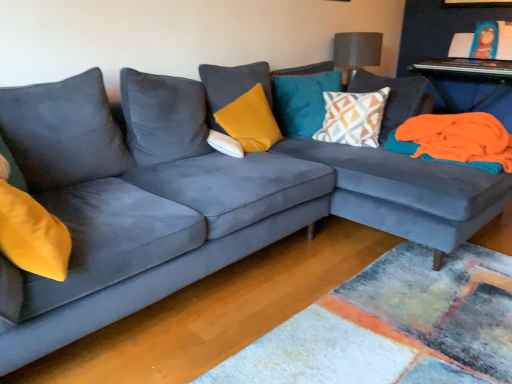
Measure the distance between orange fabric at right, positioned as the 2th table in top-to-bottom order, and camera.

orange fabric at right, positioned as the 2th table in top-to-bottom order, is 11.25 feet away from camera.

I want to click on orange fabric at right, which appears as the first table when ordered from the bottom, so click(471, 85).

Measure the distance between point (456, 72) and camera.

They are 12.63 feet apart.

This screenshot has height=384, width=512. What are the coordinates of `white soft pillow at center, the 1th pillow in the left-to-right sequence` in the screenshot? It's located at (225, 144).

I want to click on yellow velvet pillow at center, positioned as the 2th pillow in left-to-right order, so click(250, 121).

The width and height of the screenshot is (512, 384). What do you see at coordinates (302, 101) in the screenshot?
I see `teal velvet pillow at upper center, the third pillow viewed from the left` at bounding box center [302, 101].

Identify the location of orange fabric at right, which appears as the first table when ordered from the bottom. (471, 85).

Is geometric-patterned fabric pillow at center, the fourth pillow positioned from the left, with white soft pillow at center, the 1th pillow in the left-to-right sequence?

No, geometric-patterned fabric pillow at center, the fourth pillow positioned from the left, is not with white soft pillow at center, the 1th pillow in the left-to-right sequence.

Which is correct: geometric-patterned fabric pillow at center, the fourth pillow positioned from the left, is inside white soft pillow at center, placed as the fourth pillow when sorted from right to left, or outside of it?

geometric-patterned fabric pillow at center, the fourth pillow positioned from the left, cannot be found inside white soft pillow at center, placed as the fourth pillow when sorted from right to left.

What's the angular difference between geometric-patterned fabric pillow at center, placed as the first pillow when sorted from right to left, and white soft pillow at center, the 1th pillow in the left-to-right sequence,'s facing directions?

There is a 118-degree angle between the facing directions of geometric-patterned fabric pillow at center, placed as the first pillow when sorted from right to left, and white soft pillow at center, the 1th pillow in the left-to-right sequence.

Visually, is geometric-patterned fabric pillow at center, the fourth pillow positioned from the left, positioned to the left or to the right of white soft pillow at center, placed as the fourth pillow when sorted from right to left?

Clearly, geometric-patterned fabric pillow at center, the fourth pillow positioned from the left, is on the right of white soft pillow at center, placed as the fourth pillow when sorted from right to left, in the image.

Is metallic silver keyboard at upper right, which ranks as the 2th table in bottom-to-top order, turned away from orange fleece blanket at right?

No, metallic silver keyboard at upper right, which ranks as the 2th table in bottom-to-top order, is not facing away from orange fleece blanket at right.

Who is shorter, metallic silver keyboard at upper right, the 1th table viewed from the top, or orange fleece blanket at right?

orange fleece blanket at right.

Between metallic silver keyboard at upper right, the 1th table viewed from the top, and orange fleece blanket at right, which one has larger width?

With larger width is metallic silver keyboard at upper right, the 1th table viewed from the top.

From the picture: Who is bigger, geometric-patterned fabric pillow at center, the fourth pillow positioned from the left, or textured gray lampshade at upper center?

geometric-patterned fabric pillow at center, the fourth pillow positioned from the left.

Which of these two, geometric-patterned fabric pillow at center, placed as the first pillow when sorted from right to left, or textured gray lampshade at upper center, is thinner?

Thinner between the two is geometric-patterned fabric pillow at center, placed as the first pillow when sorted from right to left.

From a real-world perspective, which is physically above, geometric-patterned fabric pillow at center, the fourth pillow positioned from the left, or textured gray lampshade at upper center?

In real-world perspective, textured gray lampshade at upper center is above.

Between textured gray lampshade at upper center and yellow velvet pillow at center, positioned as the 2th pillow in left-to-right order, which one has smaller width?

yellow velvet pillow at center, positioned as the 2th pillow in left-to-right order, is thinner.

Is textured gray lampshade at upper center bigger or smaller than yellow velvet pillow at center, acting as the 3th pillow starting from the right?

textured gray lampshade at upper center is smaller than yellow velvet pillow at center, acting as the 3th pillow starting from the right.

Considering the relative positions of textured gray lampshade at upper center and yellow velvet pillow at center, positioned as the 2th pillow in left-to-right order, in the image provided, is textured gray lampshade at upper center to the right of yellow velvet pillow at center, positioned as the 2th pillow in left-to-right order, from the viewer's perspective?

Yes.

Is the depth of orange fleece blanket at right greater than that of geometric-patterned fabric pillow at center, placed as the first pillow when sorted from right to left?

No.

Which object is positioned more to the right, orange fleece blanket at right or geometric-patterned fabric pillow at center, the fourth pillow positioned from the left?

orange fleece blanket at right.

From a real-world perspective, who is located higher, orange fleece blanket at right or geometric-patterned fabric pillow at center, placed as the first pillow when sorted from right to left?

geometric-patterned fabric pillow at center, placed as the first pillow when sorted from right to left, from a real-world perspective.

Could geometric-patterned fabric pillow at center, placed as the first pillow when sorted from right to left, be considered to be inside orange fleece blanket at right?

No, geometric-patterned fabric pillow at center, placed as the first pillow when sorted from right to left, is located outside of orange fleece blanket at right.

Considering the sizes of yellow velvet pillow at center, acting as the 3th pillow starting from the right, and textured gray lampshade at upper center in the image, is yellow velvet pillow at center, acting as the 3th pillow starting from the right, bigger or smaller than textured gray lampshade at upper center?

Considering their sizes, yellow velvet pillow at center, acting as the 3th pillow starting from the right, takes up more space than textured gray lampshade at upper center.

Which is closer, (233,119) or (336,51)?

Point (233,119).

Do you think yellow velvet pillow at center, acting as the 3th pillow starting from the right, is within textured gray lampshade at upper center, or outside of it?

yellow velvet pillow at center, acting as the 3th pillow starting from the right, is not inside textured gray lampshade at upper center, it's outside.

Which object is thinner, yellow velvet pillow at center, acting as the 3th pillow starting from the right, or textured gray lampshade at upper center?

yellow velvet pillow at center, acting as the 3th pillow starting from the right, is thinner.

From the image's perspective, which is above, metallic silver keyboard at upper right, which ranks as the 2th table in bottom-to-top order, or teal velvet pillow at upper center, positioned as the 2th pillow in right-to-left order?

metallic silver keyboard at upper right, which ranks as the 2th table in bottom-to-top order, from the image's perspective.

Does metallic silver keyboard at upper right, the 1th table viewed from the top, turn towards teal velvet pillow at upper center, positioned as the 2th pillow in right-to-left order?

No, metallic silver keyboard at upper right, the 1th table viewed from the top, is not oriented towards teal velvet pillow at upper center, positioned as the 2th pillow in right-to-left order.

This screenshot has height=384, width=512. I want to click on table that is the 2nd one when counting upward from the teal velvet pillow at upper center, the third pillow viewed from the left (from the image's perspective), so click(465, 67).

Where is `the 2nd pillow below the geometric-patterned fabric pillow at center, placed as the first pillow when sorted from right to left (from a real-world perspective)`? the 2nd pillow below the geometric-patterned fabric pillow at center, placed as the first pillow when sorted from right to left (from a real-world perspective) is located at coordinates (225, 144).

Where is `material in front of the metallic silver keyboard at upper right, the 1th table viewed from the top`? material in front of the metallic silver keyboard at upper right, the 1th table viewed from the top is located at coordinates (455, 140).

Considering their positions, is yellow velvet pillow at center, acting as the 3th pillow starting from the right, positioned closer to textured gray lampshade at upper center than geometric-patterned fabric pillow at center, placed as the first pillow when sorted from right to left?

The object closer to textured gray lampshade at upper center is geometric-patterned fabric pillow at center, placed as the first pillow when sorted from right to left.

Looking at the image, which one is located further to orange fleece blanket at right, orange fabric at right, positioned as the 2th table in top-to-bottom order, or geometric-patterned fabric pillow at center, placed as the first pillow when sorted from right to left?

The object further to orange fleece blanket at right is orange fabric at right, positioned as the 2th table in top-to-bottom order.

Estimate the real-world distances between objects in this image. Which object is closer to white soft pillow at center, placed as the fourth pillow when sorted from right to left, yellow velvet pillow at center, acting as the 3th pillow starting from the right, or textured gray lampshade at upper center?

yellow velvet pillow at center, acting as the 3th pillow starting from the right, is closer to white soft pillow at center, placed as the fourth pillow when sorted from right to left.

Which object lies nearer to the anchor point yellow velvet pillow at center, acting as the 3th pillow starting from the right, metallic silver keyboard at upper right, the 1th table viewed from the top, or textured gray lampshade at upper center?

textured gray lampshade at upper center lies closer to yellow velvet pillow at center, acting as the 3th pillow starting from the right, than the other object.

Which object lies further to the anchor point orange fabric at right, positioned as the 2th table in top-to-bottom order, teal velvet pillow at upper center, positioned as the 2th pillow in right-to-left order, or yellow velvet pillow at center, positioned as the 2th pillow in left-to-right order?

yellow velvet pillow at center, positioned as the 2th pillow in left-to-right order, is positioned further to the anchor orange fabric at right, positioned as the 2th table in top-to-bottom order.

Considering their positions, is teal velvet pillow at upper center, the third pillow viewed from the left, positioned further to textured gray lampshade at upper center than orange fabric at right, positioned as the 2th table in top-to-bottom order?

The object further to textured gray lampshade at upper center is orange fabric at right, positioned as the 2th table in top-to-bottom order.

Based on the photo, from the image, which object appears to be nearer to geometric-patterned fabric pillow at center, placed as the first pillow when sorted from right to left, orange fleece blanket at right or white soft pillow at center, placed as the fourth pillow when sorted from right to left?

Among the two, orange fleece blanket at right is located nearer to geometric-patterned fabric pillow at center, placed as the first pillow when sorted from right to left.

Considering their positions, is white soft pillow at center, placed as the fourth pillow when sorted from right to left, positioned closer to geometric-patterned fabric pillow at center, the fourth pillow positioned from the left, than orange fleece blanket at right?

orange fleece blanket at right is closer to geometric-patterned fabric pillow at center, the fourth pillow positioned from the left.

Locate an element on the screen. pillow between teal velvet pillow at upper center, positioned as the 2th pillow in right-to-left order, and orange fleece blanket at right, in the horizontal direction is located at coordinates (353, 118).

The image size is (512, 384). I want to click on material between teal velvet pillow at upper center, the third pillow viewed from the left, and orange fabric at right, positioned as the 2th table in top-to-bottom order, in the horizontal direction, so click(455, 140).

Identify the location of pillow between teal velvet pillow at upper center, positioned as the 2th pillow in right-to-left order, and orange fabric at right, which appears as the first table when ordered from the bottom, in the horizontal direction. (353, 118).

This screenshot has height=384, width=512. Identify the location of lamp between yellow velvet pillow at center, positioned as the 2th pillow in left-to-right order, and metallic silver keyboard at upper right, which ranks as the 2th table in bottom-to-top order, from left to right. (356, 51).